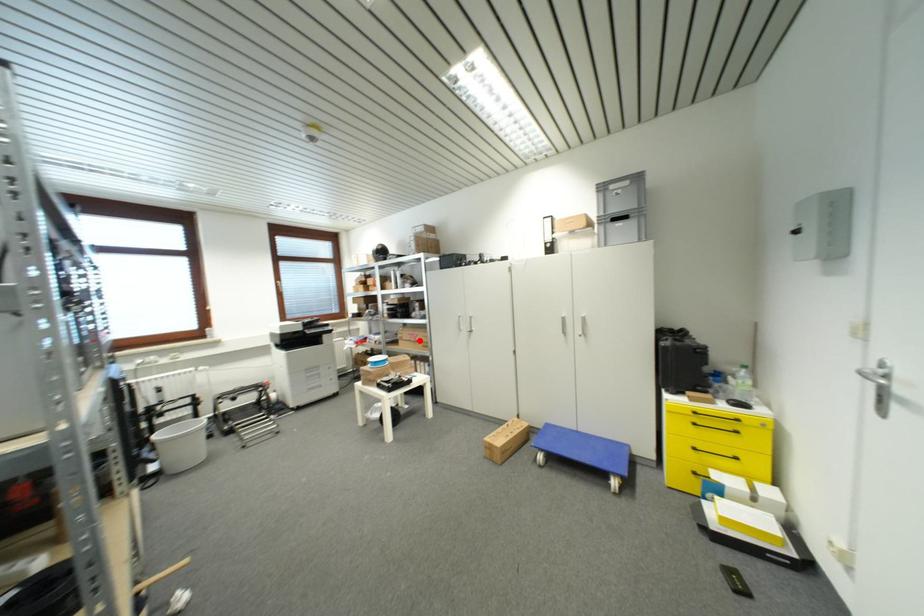
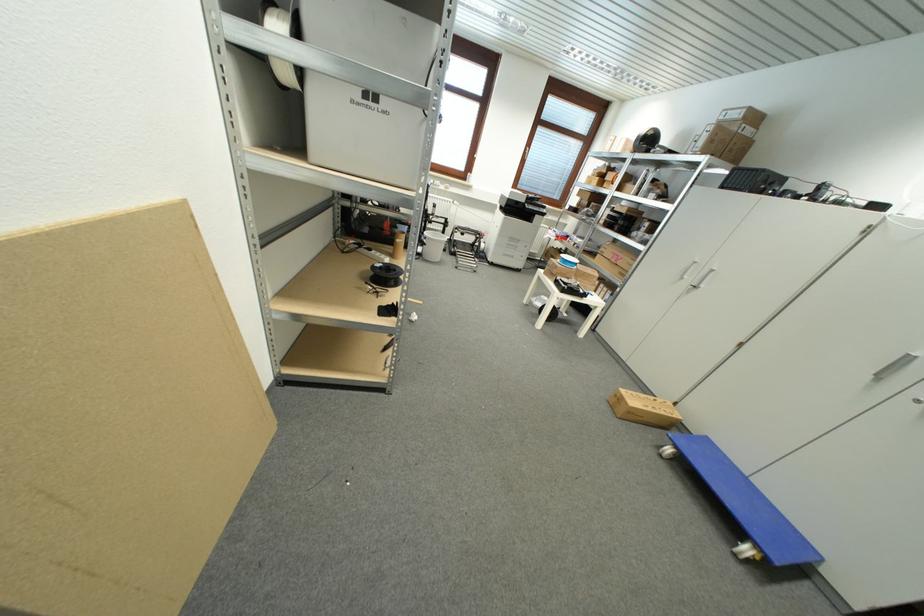
Question: I am providing you with two images of the same scene from different viewpoints. In image1, a red point is highlighted. Considering the same 3D point in image2, which of the following is correct?

Choices:
 (A) It is closer
 (B) It is farther

Answer: (A)